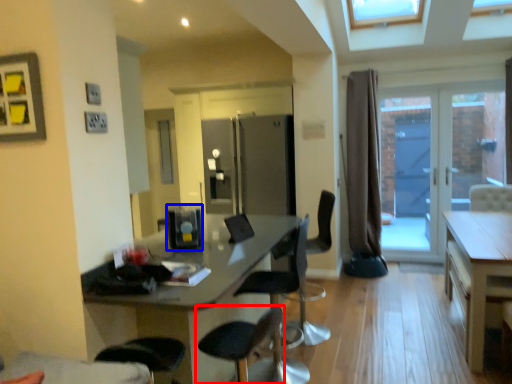
Question: Which object is closer to the camera taking this photo, chair (highlighted by a red box) or appliance (highlighted by a blue box)?

Choices:
 (A) chair
 (B) appliance

Answer: (A)